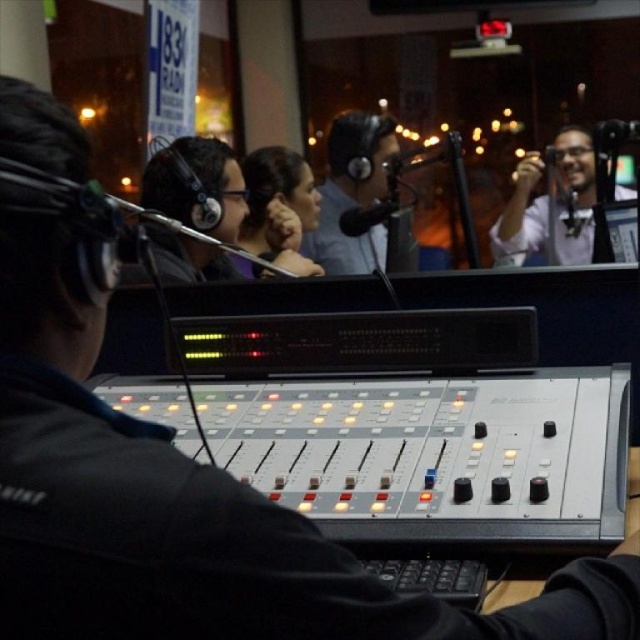
Question: Which object is positioned closest to the matte black camera at upper right?

Choices:
 (A) matte black headphones at center
 (B) matte black hair at center

Answer: (A)

Question: Which of the following is the closest to the observer?

Choices:
 (A) matte black headphones at center
 (B) matte black camera at upper right
 (C) matte black hair at center

Answer: (B)

Question: Is matte black headphones at center positioned at the back of matte black hair at center?

Choices:
 (A) no
 (B) yes

Answer: (A)

Question: Can you confirm if matte black camera at upper right is thinner than matte black hair at center?

Choices:
 (A) yes
 (B) no

Answer: (B)

Question: Is matte black camera at upper right above matte black hair at center?

Choices:
 (A) yes
 (B) no

Answer: (B)

Question: Which of the following is the farthest from the observer?

Choices:
 (A) (512, 202)
 (B) (342, 161)
 (C) (275, 228)

Answer: (B)